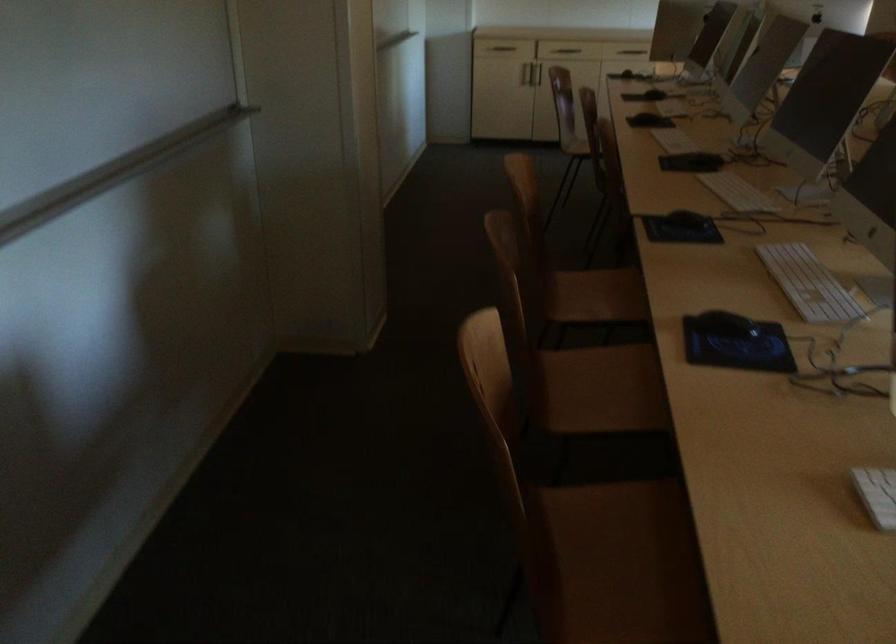
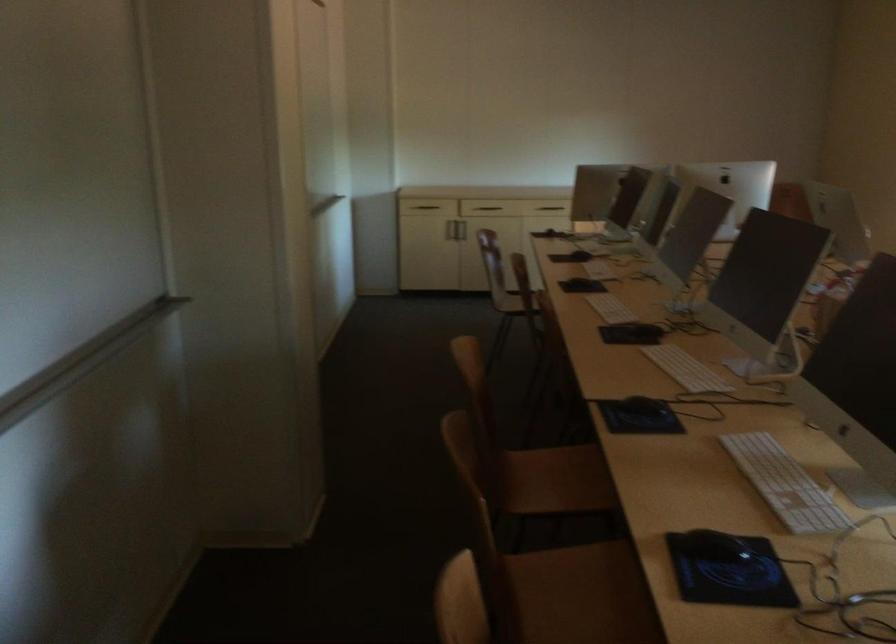
Locate, in the second image, the point that corresponds to (x=581, y=144) in the first image.

(512, 303)